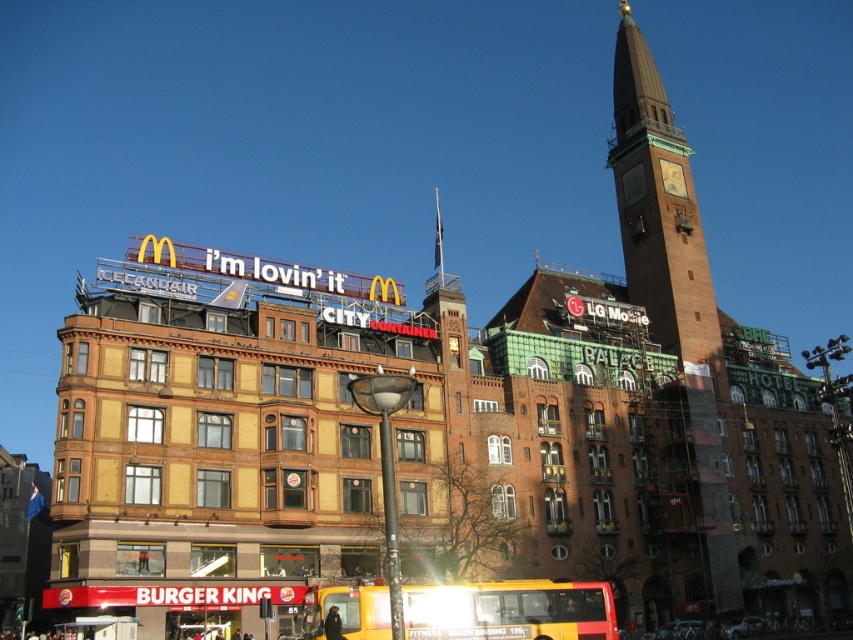
You are a tourist standing in front of the brown brick clock tower at center and the yellow matte bus at lower center. Which object would you have to look up more to see the top of?

The brown brick clock tower at center is much taller than the yellow matte bus at lower center, so you would have to look up more to see the top of the brown brick clock tower at center.

You are standing at the entrance of the Burger King restaurant and want to take a photo of the brown brick clock tower at center. Which direction should you face to capture it in your view?

The brown brick clock tower at center is located at point 0.439 on the x axis and 0.789 on the y axis, so you should face towards the center of the image to capture it in your view.